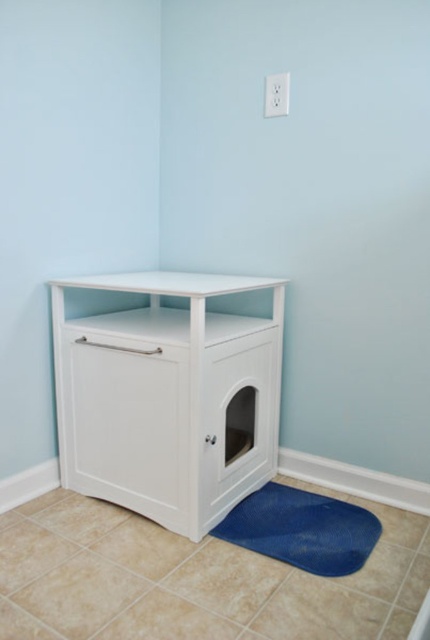
Question: Which of the following is the closest to the observer?

Choices:
 (A) white matte cabinet at lower left
 (B) blue textured mat at lower center

Answer: (B)

Question: From the image, what is the correct spatial relationship of white matte cabinet at lower left in relation to blue textured mat at lower center?

Choices:
 (A) below
 (B) above

Answer: (B)

Question: Among these objects, which one is farthest from the camera?

Choices:
 (A) blue textured mat at lower center
 (B) white matte cabinet at lower left

Answer: (B)

Question: In this image, where is white matte cabinet at lower left located relative to blue textured mat at lower center?

Choices:
 (A) left
 (B) right

Answer: (A)

Question: Is white matte cabinet at lower left smaller than blue textured mat at lower center?

Choices:
 (A) no
 (B) yes

Answer: (A)